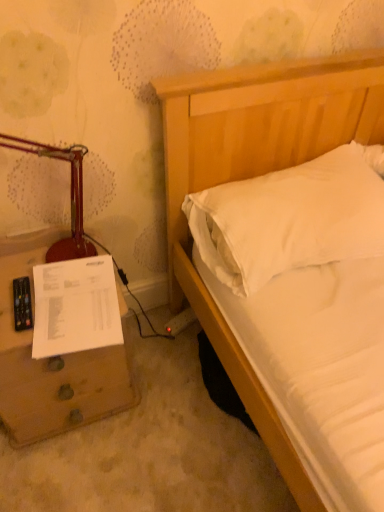
Identify the location of free space below matte red table lamp at left (from a real-world perspective). (24, 268).